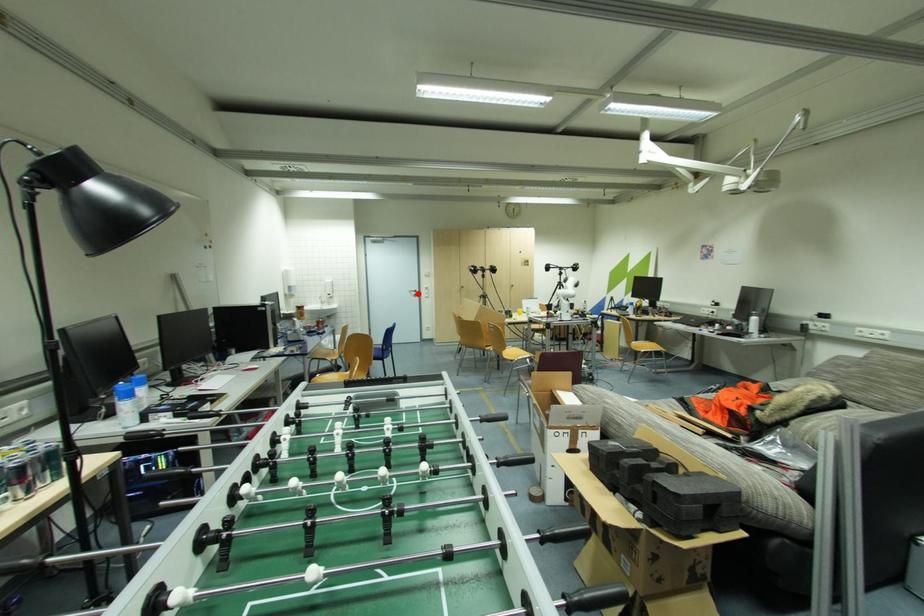
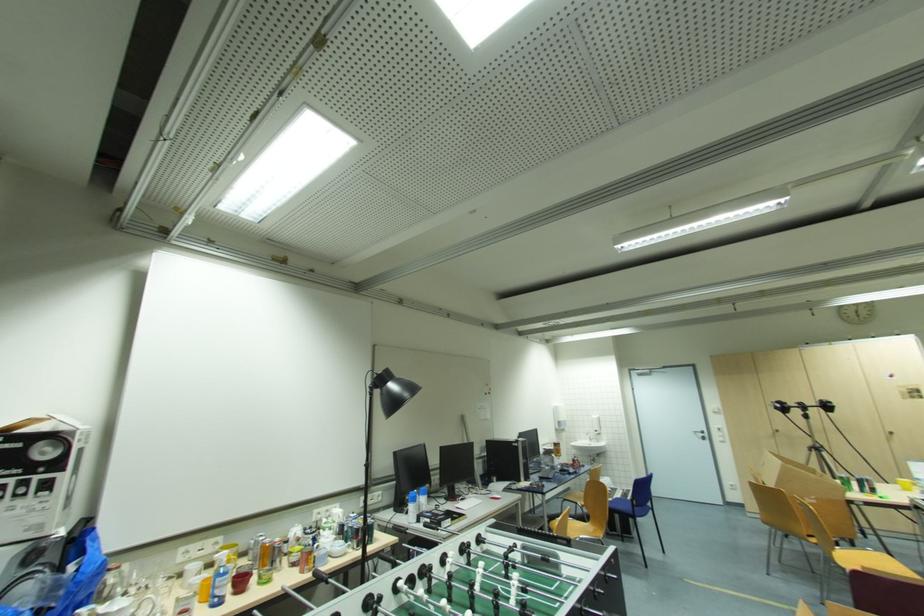
Question: I am providing you with two images of the same scene from different viewpoints. In image1, a red point is highlighted. Considering the same 3D point in image2, which of the following is correct?

Choices:
 (A) It is closer
 (B) It is farther

Answer: (B)